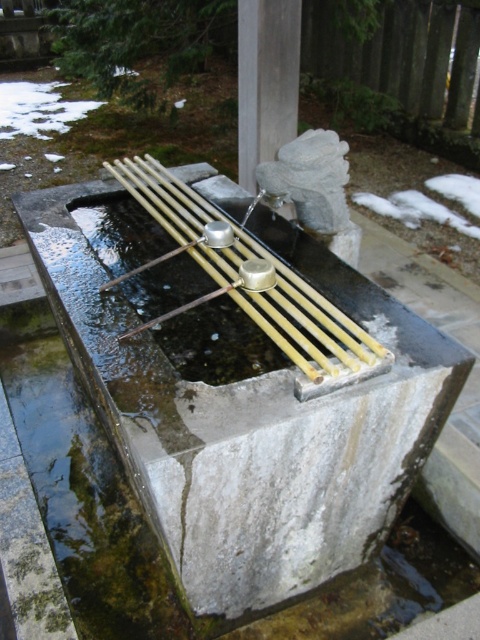
Is yellow bamboo sticks at center bigger than smooth gray stone at center?

Yes, yellow bamboo sticks at center is bigger than smooth gray stone at center.

Does yellow bamboo sticks at center have a smaller size compared to smooth gray stone at center?

No, yellow bamboo sticks at center is not smaller than smooth gray stone at center.

What do you see at coordinates (259, 282) in the screenshot? I see `yellow bamboo sticks at center` at bounding box center [259, 282].

This screenshot has height=640, width=480. I want to click on yellow bamboo sticks at center, so click(259, 282).

Between smooth concrete basin at center and smooth gray stone at center, which one is positioned lower?

Positioned lower is smooth concrete basin at center.

Does point (419, 380) come behind point (265, 150)?

No, (419, 380) is closer to viewer.

At what (x,y) coordinates should I click in order to perform the action: click on smooth concrete basin at center. Please return your answer as a coordinate pair (x, y). Looking at the image, I should click on (250, 428).

Between smooth concrete basin at center and yellow bamboo sticks at center, which one is positioned higher?

yellow bamboo sticks at center is higher up.

Does smooth concrete basin at center have a greater height compared to yellow bamboo sticks at center?

Correct, smooth concrete basin at center is much taller as yellow bamboo sticks at center.

Measure the distance between point (308, 563) and camera.

6.03 feet

The width and height of the screenshot is (480, 640). In order to click on smooth concrete basin at center in this screenshot , I will do `click(250, 428)`.